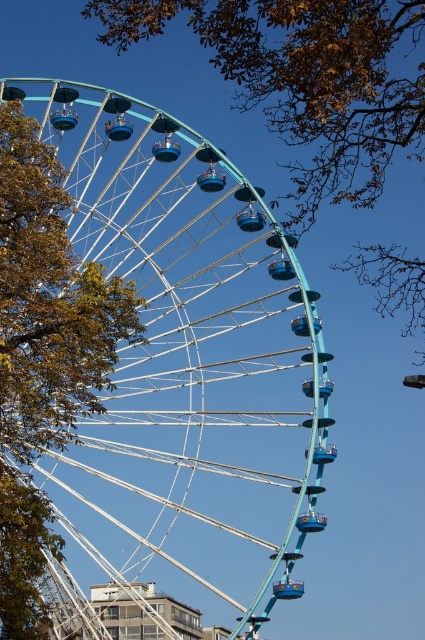
Question: Estimate the real-world distances between objects in this image. Which object is closer to the green leafy tree at left?

Choices:
 (A) teal metallic ferris wheel at center
 (B) brown leafy tree at upper center

Answer: (A)

Question: Estimate the real-world distances between objects in this image. Which object is farther from the brown leafy tree at upper center?

Choices:
 (A) green leafy tree at left
 (B) teal metallic ferris wheel at center

Answer: (A)

Question: Is teal metallic ferris wheel at center above brown leafy tree at upper center?

Choices:
 (A) yes
 (B) no

Answer: (B)

Question: Is brown leafy tree at upper center positioned behind green leafy tree at left?

Choices:
 (A) no
 (B) yes

Answer: (A)

Question: Can you confirm if teal metallic ferris wheel at center is bigger than green leafy tree at left?

Choices:
 (A) yes
 (B) no

Answer: (A)

Question: Which point is closer to the camera taking this photo?

Choices:
 (A) (70, 296)
 (B) (238, 481)

Answer: (A)